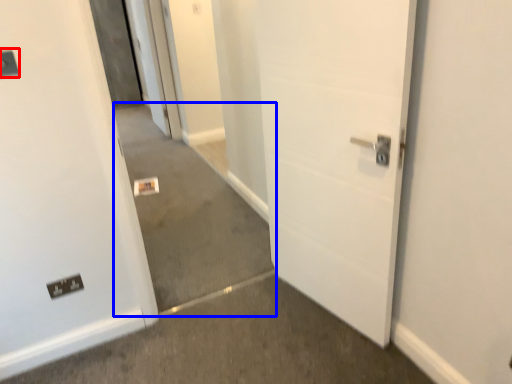
Question: Which point is further to the camera, light switch (highlighted by a red box) or concrete (highlighted by a blue box)?

Choices:
 (A) light switch
 (B) concrete

Answer: (B)